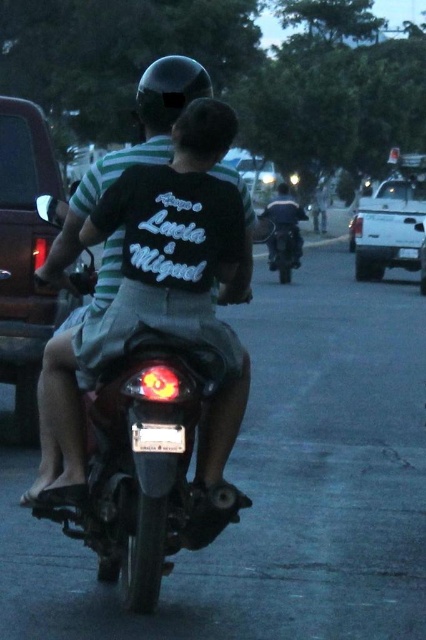
Question: Among these objects, which one is farthest from the camera?

Choices:
 (A) white matte pickup truck at upper right
 (B) matte black motorcycle at center
 (C) shiny black motorcycle at center

Answer: (A)

Question: Which object appears farthest from the camera in this image?

Choices:
 (A) matte black motorcycle at center
 (B) shiny black motorcycle at center

Answer: (B)

Question: Observing the image, what is the correct spatial positioning of matte black motorcycle at center in reference to shiny black motorcycle at center?

Choices:
 (A) below
 (B) above

Answer: (A)

Question: Is the position of matte black motorcycle at center more distant than that of white matte pickup truck at upper right?

Choices:
 (A) yes
 (B) no

Answer: (B)

Question: Based on their relative distances, which object is farther from the white matte pickup truck at upper right?

Choices:
 (A) shiny black motorcycle at center
 (B) matte black motorcycle at center

Answer: (B)

Question: Is matte black motorcycle at center to the left of white matte pickup truck at upper right from the viewer's perspective?

Choices:
 (A) yes
 (B) no

Answer: (A)